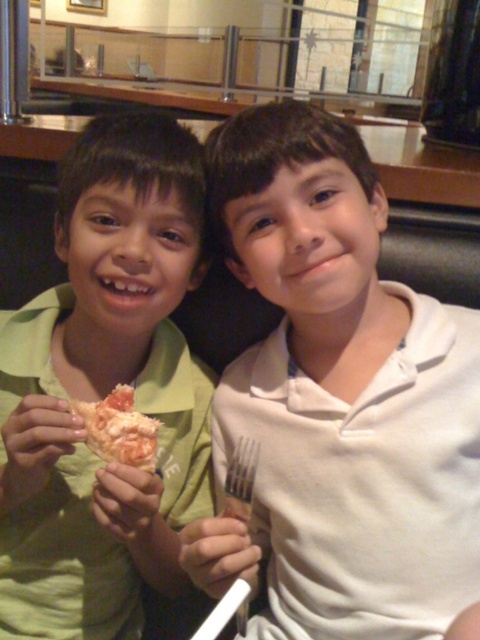
Question: Which of the following is the farthest from the observer?

Choices:
 (A) white matte fork at right
 (B) shiny orange pizza slice at center

Answer: (B)

Question: Is green matte shirt at left positioned behind shiny orange pizza slice at center?

Choices:
 (A) no
 (B) yes

Answer: (A)

Question: Can you confirm if green matte shirt at left is positioned to the right of shiny orange pizza slice at center?

Choices:
 (A) no
 (B) yes

Answer: (B)

Question: Can you confirm if white matte fork at right is positioned to the right of green matte shirt at left?

Choices:
 (A) yes
 (B) no

Answer: (A)

Question: Estimate the real-world distances between objects in this image. Which object is farther from the white matte fork at right?

Choices:
 (A) green matte shirt at left
 (B) shiny orange pizza slice at center

Answer: (B)

Question: Considering the real-world distances, which object is closest to the white matte fork at right?

Choices:
 (A) green matte shirt at left
 (B) shiny orange pizza slice at center

Answer: (A)